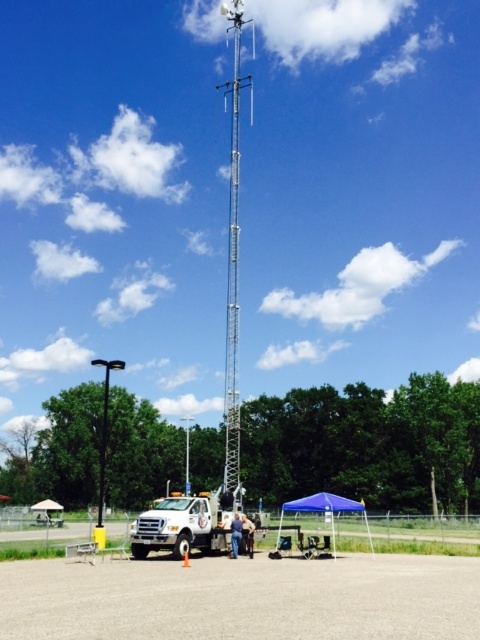
What do you see at coordinates (181, 525) in the screenshot?
I see `white matte truck at lower center` at bounding box center [181, 525].

Does white matte truck at lower center have a lesser width compared to blue jeans at center?

No.

Is point (228, 538) more distant than point (232, 548)?

Yes, it is.

The image size is (480, 640). In order to click on white matte truck at lower center in this screenshot , I will do `click(181, 525)`.

Between silver metallic antenna at center and white matte truck at lower center, which one has less height?

white matte truck at lower center

Does silver metallic antenna at center have a lesser height compared to white matte truck at lower center?

Incorrect, silver metallic antenna at center's height does not fall short of white matte truck at lower center's.

Which is behind, point (243, 83) or point (201, 506)?

The point (243, 83) is behind.

This screenshot has width=480, height=640. I want to click on silver metallic antenna at center, so click(232, 264).

Describe the element at coordinates (181, 525) in the screenshot. I see `white matte truck at lower center` at that location.

Is point (212, 502) less distant than point (100, 513)?

Yes, it is.

Between point (182, 497) and point (96, 364), which one is positioned behind?

Point (96, 364)

Identify the location of white matte truck at lower center. Image resolution: width=480 pixels, height=640 pixels. (181, 525).